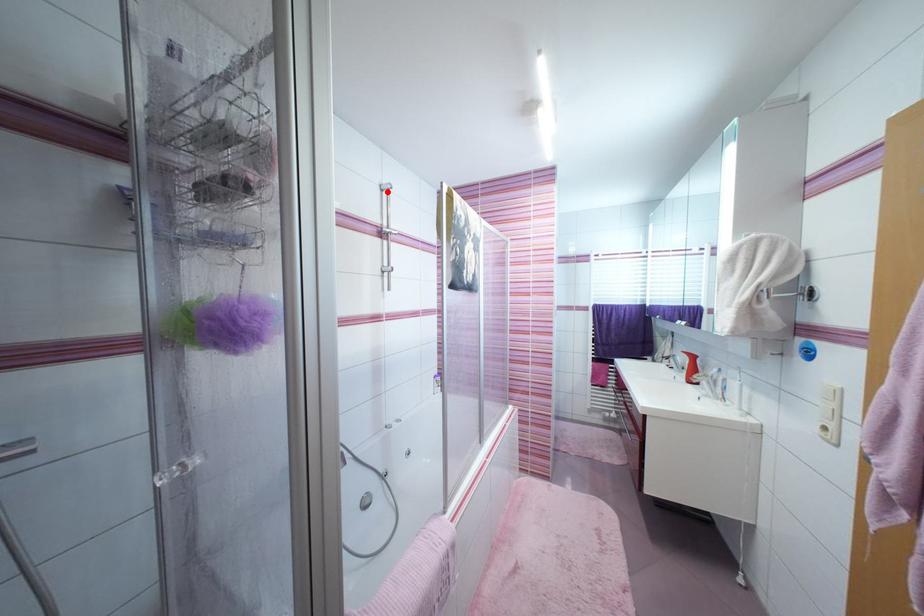
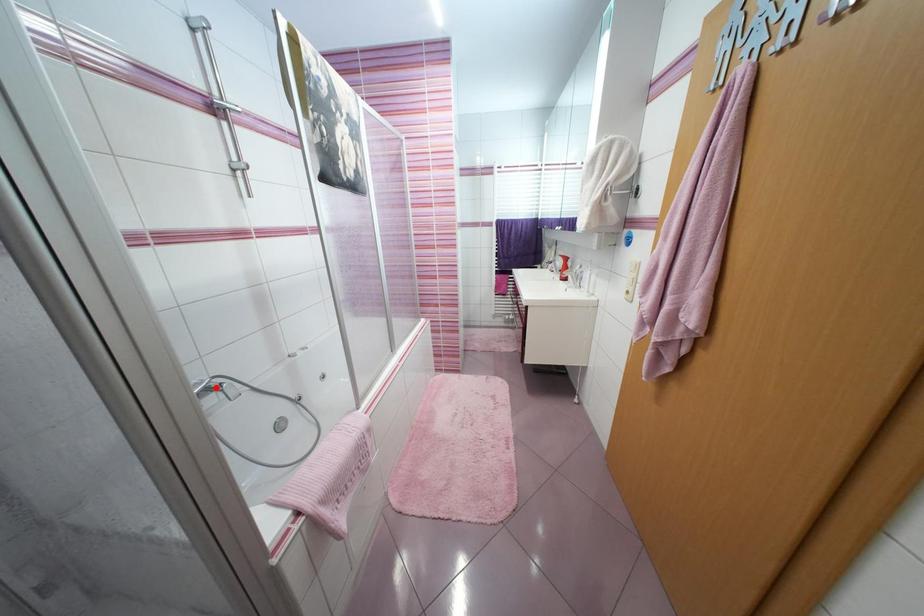
I am providing you with two images of the same scene from different viewpoints. A red point is marked on the first image and another point is marked on the second image. Do the highlighted points in image1 and image2 indicate the same real-world spot?

No